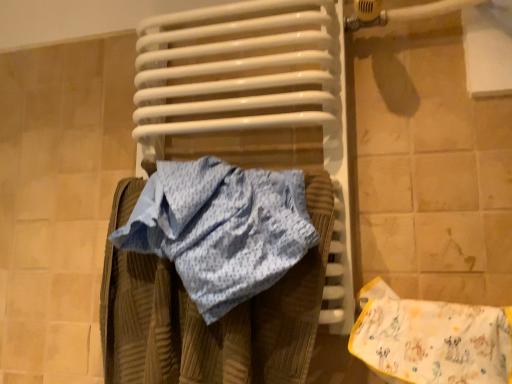
What is the approximate width of yellow cotton bib at lower right?

It is 4.60 inches.

Measure the distance between point [457,312] and camera.

The depth of point [457,312] is 25.75 inches.

Describe the element at coordinates (431, 339) in the screenshot. I see `yellow cotton bib at lower right` at that location.

You are a GUI agent. You are given a task and a screenshot of the screen. Output one action in this format:
    pyautogui.click(x=<x>, y=<y>)
    Task: Click on the yellow cotton bib at lower right
    
    Given the screenshot: What is the action you would take?
    pyautogui.click(x=431, y=339)

What do you see at coordinates (253, 102) in the screenshot? This screenshot has width=512, height=384. I see `white glossy radiator at center` at bounding box center [253, 102].

Where is `white glossy radiator at center`? This screenshot has width=512, height=384. white glossy radiator at center is located at coordinates (253, 102).

Identify the location of yellow cotton bib at lower right. This screenshot has width=512, height=384. (431, 339).

Which object is positioned more to the right, white glossy radiator at center or yellow cotton bib at lower right?

yellow cotton bib at lower right.

In the scene shown: Does white glossy radiator at center come behind yellow cotton bib at lower right?

Yes, the depth of white glossy radiator at center is greater than that of yellow cotton bib at lower right.

Which is closer to the camera, (167, 94) or (397, 297)?

Clearly, point (167, 94) is more distant from the camera than point (397, 297).

From the image's perspective, who appears lower, white glossy radiator at center or yellow cotton bib at lower right?

yellow cotton bib at lower right is shown below in the image.

From a real-world perspective, is white glossy radiator at center over yellow cotton bib at lower right?

Yes, from a real-world perspective, white glossy radiator at center is above yellow cotton bib at lower right.

Considering the sizes of objects white glossy radiator at center and yellow cotton bib at lower right in the image provided, who is wider, white glossy radiator at center or yellow cotton bib at lower right?

Wider between the two is white glossy radiator at center.

Who is shorter, white glossy radiator at center or yellow cotton bib at lower right?

yellow cotton bib at lower right is shorter.

Considering the sizes of objects white glossy radiator at center and yellow cotton bib at lower right in the image provided, who is bigger, white glossy radiator at center or yellow cotton bib at lower right?

white glossy radiator at center.

Which is correct: white glossy radiator at center is inside yellow cotton bib at lower right, or outside of it?

white glossy radiator at center cannot be found inside yellow cotton bib at lower right.

In the scene shown: Is white glossy radiator at center not close to yellow cotton bib at lower right?

No, white glossy radiator at center is not far away from yellow cotton bib at lower right.

Is white glossy radiator at center facing towards yellow cotton bib at lower right?

No, white glossy radiator at center is not turned towards yellow cotton bib at lower right.

How many degrees apart are the facing directions of white glossy radiator at center and yellow cotton bib at lower right?

The facing directions of white glossy radiator at center and yellow cotton bib at lower right are 0.000234 degrees apart.

How distant is white glossy radiator at center from yellow cotton bib at lower right?

white glossy radiator at center and yellow cotton bib at lower right are 13.39 inches apart from each other.

Where is `water heater above the yellow cotton bib at lower right (from the image's perspective)`? The height and width of the screenshot is (384, 512). water heater above the yellow cotton bib at lower right (from the image's perspective) is located at coordinates (253, 102).

Is yellow cotton bib at lower right to the right of white glossy radiator at center from the viewer's perspective?

Correct, you'll find yellow cotton bib at lower right to the right of white glossy radiator at center.

Does yellow cotton bib at lower right lie behind white glossy radiator at center?

No, it is not.

Considering the positions of point (510, 354) and point (286, 53), is point (510, 354) closer or farther from the camera than point (286, 53)?

Point (510, 354) appears to be closer to the viewer than point (286, 53).

From the image's perspective, is yellow cotton bib at lower right positioned above or below white glossy radiator at center?

yellow cotton bib at lower right is situated lower than white glossy radiator at center in the image.

From a real-world perspective, is yellow cotton bib at lower right above or below white glossy radiator at center?

In terms of real-world spatial position, yellow cotton bib at lower right is below white glossy radiator at center.

Between yellow cotton bib at lower right and white glossy radiator at center, which one has larger width?

Wider between the two is white glossy radiator at center.

From their relative heights in the image, would you say yellow cotton bib at lower right is taller or shorter than white glossy radiator at center?

In the image, yellow cotton bib at lower right appears to be shorter than white glossy radiator at center.

Does yellow cotton bib at lower right have a smaller size compared to white glossy radiator at center?

Yes.

Is white glossy radiator at center a part of yellow cotton bib at lower right?

No, white glossy radiator at center is located outside of yellow cotton bib at lower right.

Is yellow cotton bib at lower right far from white glossy radiator at center?

That's not correct — yellow cotton bib at lower right is a little close to white glossy radiator at center.

Could you tell me if yellow cotton bib at lower right is facing white glossy radiator at center?

No, yellow cotton bib at lower right is not oriented towards white glossy radiator at center.

How many degrees apart are the facing directions of yellow cotton bib at lower right and white glossy radiator at center?

The angular difference between yellow cotton bib at lower right and white glossy radiator at center is 0.000234 degrees.

The width and height of the screenshot is (512, 384). Find the location of `water heater that is behind the yellow cotton bib at lower right`. water heater that is behind the yellow cotton bib at lower right is located at coordinates (253, 102).

Where is `water heater lying above the yellow cotton bib at lower right (from the image's perspective)`? The width and height of the screenshot is (512, 384). water heater lying above the yellow cotton bib at lower right (from the image's perspective) is located at coordinates (253, 102).

This screenshot has width=512, height=384. In the image, there is a white glossy radiator at center. What are the coordinates of `material below it (from a real-world perspective)` in the screenshot? It's located at (431, 339).